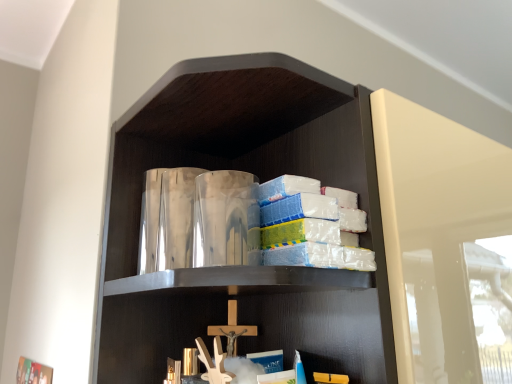
The height and width of the screenshot is (384, 512). In order to click on matte plastic bags at upper center in this screenshot , I will do `click(260, 182)`.

What do you see at coordinates (260, 182) in the screenshot?
I see `matte plastic bags at upper center` at bounding box center [260, 182].

What are the coordinates of `matte plastic bags at upper center` in the screenshot? It's located at (260, 182).